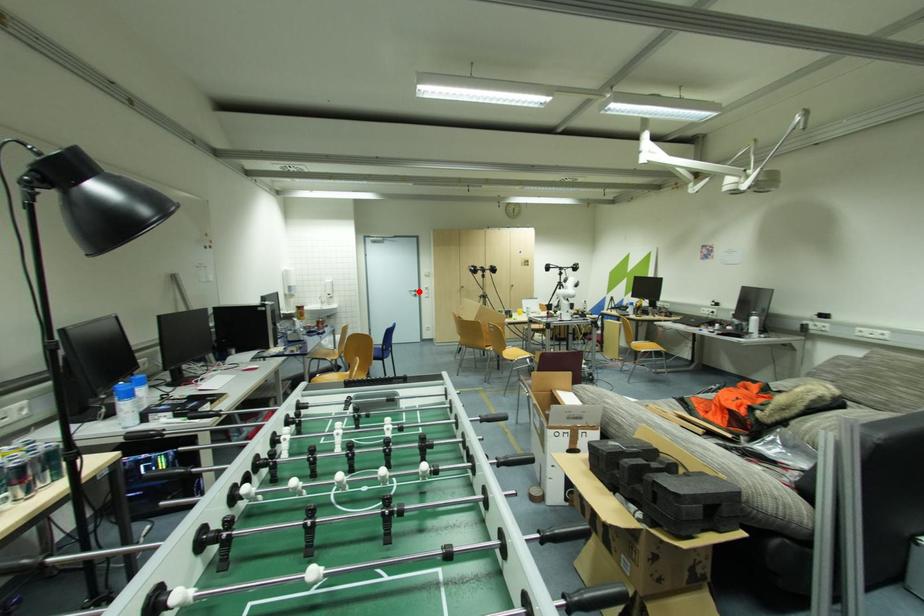
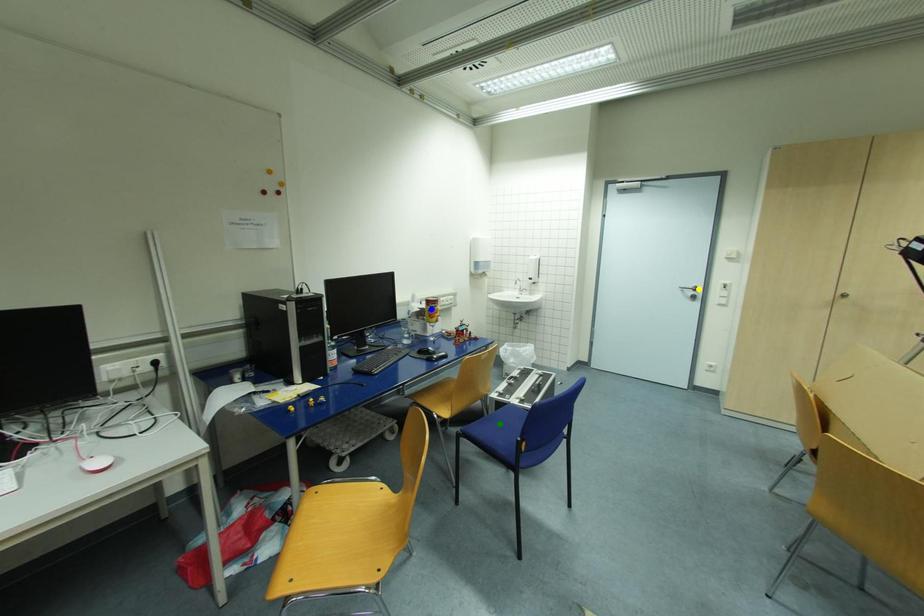
Question: I am providing you with two images of the same scene from different viewpoints. A red point is marked on the first image. You are given multiple points on the second image. In image 2, which mark is for the same physical point as the one in image 1?

Choices:
 (A) yellow point
 (B) blue point
 (C) green point

Answer: (A)